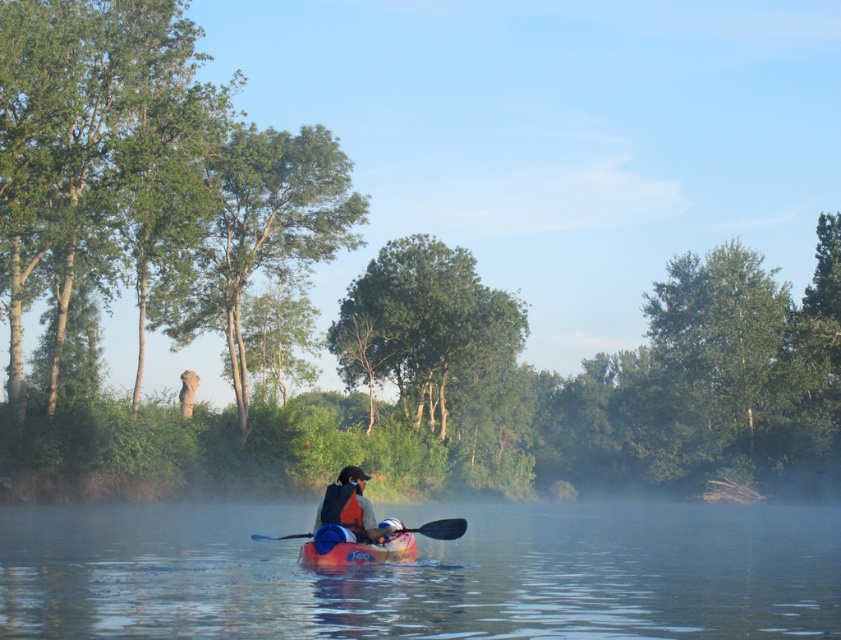
Is point (706, 288) positioned in front of point (453, 534)?

No, it is not.

Is green leafy tree at right shorter than smooth black paddle at center?

In fact, green leafy tree at right may be taller than smooth black paddle at center.

The image size is (841, 640). What are the coordinates of `green leafy tree at right` in the screenshot? It's located at (723, 372).

Is smooth water at center below smooth black paddle at center?

Correct, smooth water at center is located below smooth black paddle at center.

Which of these two, smooth water at center or smooth black paddle at center, stands taller?

With more height is smooth water at center.

Image resolution: width=841 pixels, height=640 pixels. In order to click on smooth water at center in this screenshot , I will do `click(424, 572)`.

Between point (475, 348) and point (403, 547), which one is positioned behind?

Point (475, 348)

From the picture: Between green leafy tree at center and orange plastic canoe at center, which one is positioned higher?

Positioned higher is green leafy tree at center.

Measure the distance between point (340, 308) and camera.

Point (340, 308) is 98.46 meters from camera.

Identify the location of green leafy tree at center. (424, 326).